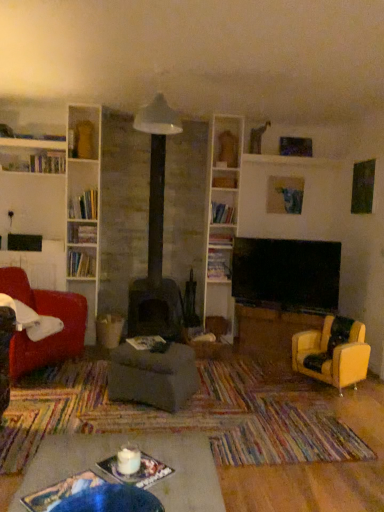
Question: From a real-world perspective, is white glossy bookshelf at upper center, the 2th shelf when ordered from top to bottom, under velvet red armchair at left, placed as the second chair when sorted from right to left?

Choices:
 (A) yes
 (B) no

Answer: (B)

Question: Would you say white glossy bookshelf at upper center, the 2th shelf when ordered from top to bottom, contains velvet red armchair at left, which is counted as the 1th chair, starting from the left?

Choices:
 (A) no
 (B) yes

Answer: (A)

Question: Does white glossy bookshelf at upper center, the 2th shelf when ordered from top to bottom, have a greater width compared to velvet red armchair at left, which is counted as the 1th chair, starting from the left?

Choices:
 (A) no
 (B) yes

Answer: (A)

Question: From a real-world perspective, does white glossy bookshelf at upper center, positioned as the third shelf in bottom-to-top order, stand above velvet red armchair at left, which is counted as the 1th chair, starting from the left?

Choices:
 (A) yes
 (B) no

Answer: (A)

Question: Would you say white glossy bookshelf at upper center, positioned as the third shelf in bottom-to-top order, is outside velvet red armchair at left, placed as the second chair when sorted from right to left?

Choices:
 (A) no
 (B) yes

Answer: (B)

Question: Considering their positions, is white glossy bookshelf at upper left, which appears as the 4th shelf when viewed from the right, located in front of or behind matte blue painting at upper center?

Choices:
 (A) front
 (B) behind

Answer: (A)

Question: Which is correct: white glossy bookshelf at upper left, which appears as the 4th shelf when viewed from the right, is inside matte blue painting at upper center, or outside of it?

Choices:
 (A) outside
 (B) inside

Answer: (A)

Question: In terms of width, does white glossy bookshelf at upper left, which is the third shelf from top to bottom, look wider or thinner when compared to matte blue painting at upper center?

Choices:
 (A) wide
 (B) thin

Answer: (A)

Question: Considering the relative positions of white glossy bookshelf at upper left, which appears as the 4th shelf when viewed from the right, and matte blue painting at upper center in the image provided, is white glossy bookshelf at upper left, which appears as the 4th shelf when viewed from the right, to the left or to the right of matte blue painting at upper center?

Choices:
 (A) left
 (B) right

Answer: (A)

Question: Does point (74, 260) appear closer or farther from the camera than point (337, 367)?

Choices:
 (A) closer
 (B) farther

Answer: (B)

Question: Would you say white glossy bookshelf at upper left, which is the third shelf from top to bottom, is inside or outside yellow leather armchair at right, acting as the second chair starting from the left?

Choices:
 (A) outside
 (B) inside

Answer: (A)

Question: Considering their positions, is white glossy bookshelf at upper left, acting as the second shelf starting from the bottom, located in front of or behind yellow leather armchair at right, the first chair when ordered from right to left?

Choices:
 (A) behind
 (B) front

Answer: (A)

Question: Is white glossy bookshelf at upper left, the 1th shelf in the left-to-right sequence, wider or thinner than yellow leather armchair at right, the first chair when ordered from right to left?

Choices:
 (A) wide
 (B) thin

Answer: (B)

Question: From the image's perspective, is velvet red armchair at left, which is counted as the 1th chair, starting from the left, positioned above or below yellow leather armchair at right, acting as the second chair starting from the left?

Choices:
 (A) above
 (B) below

Answer: (A)

Question: Considering the positions of velvet red armchair at left, which is counted as the 1th chair, starting from the left, and yellow leather armchair at right, the first chair when ordered from right to left, in the image, is velvet red armchair at left, which is counted as the 1th chair, starting from the left, taller or shorter than yellow leather armchair at right, the first chair when ordered from right to left,?

Choices:
 (A) tall
 (B) short

Answer: (A)